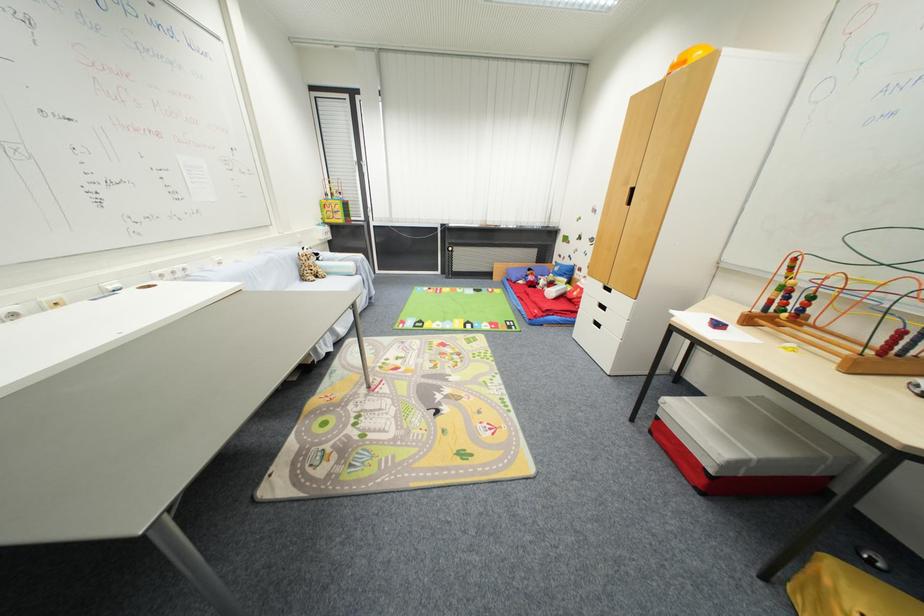
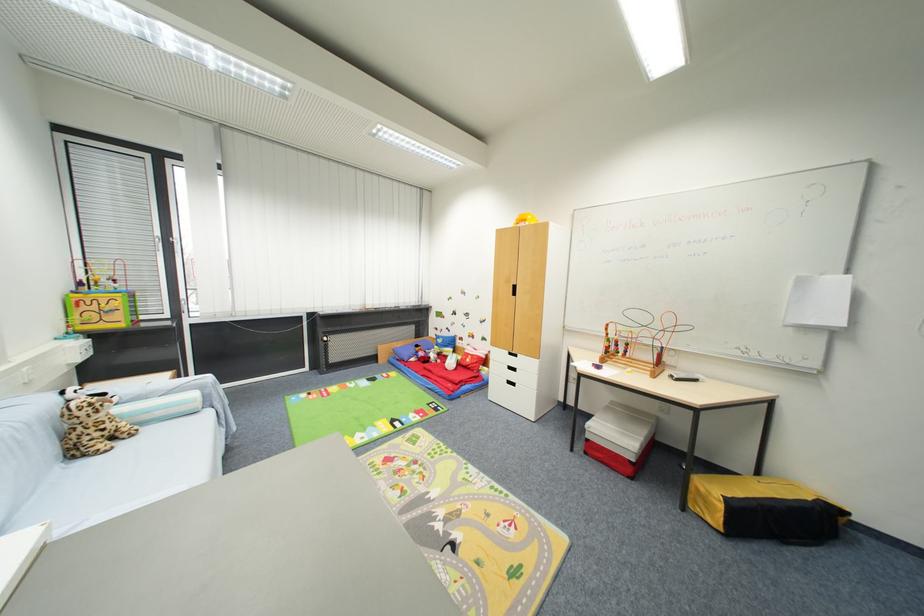
Question: Based on the continuous images, in which direction is the camera rotating? Reply with the corresponding letter.

Choices:
 (A) Left
 (B) Right
 (C) Up
 (D) Down

Answer: (B)